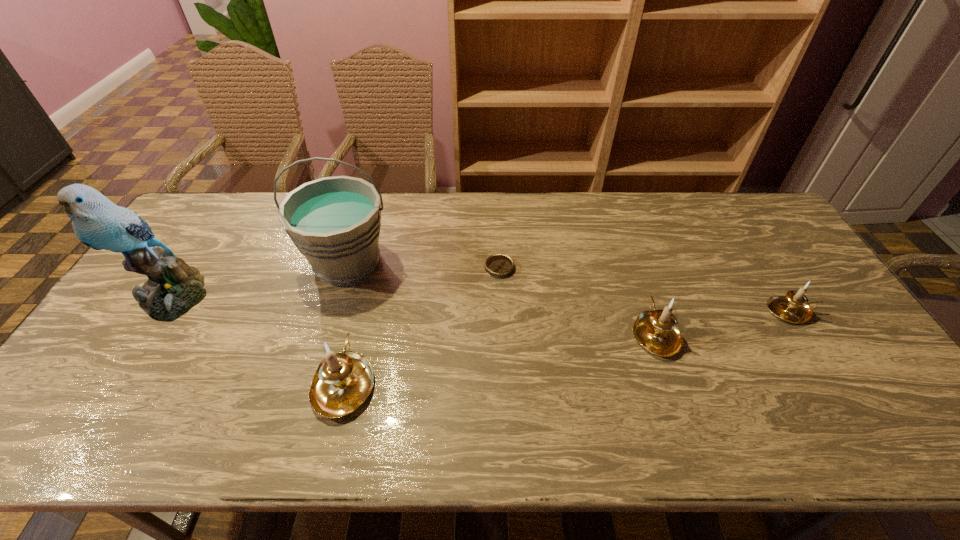
You are a GUI agent. You are given a task and a screenshot of the screen. Output one action in this format:
    pyautogui.click(x=<x>, y=<y>)
    Task: Click on the object that is at the near edge
    The width and height of the screenshot is (960, 540).
    Given the screenshot: What is the action you would take?
    pyautogui.click(x=343, y=381)

The width and height of the screenshot is (960, 540). Identify the location of object at the left edge. (173, 288).

The image size is (960, 540). I want to click on object located in the right edge section of the desktop, so click(x=794, y=307).

I want to click on free region at the far edge, so click(x=443, y=230).

The image size is (960, 540). Find the location of `free location at the near edge`. free location at the near edge is located at coordinates (199, 394).

You are a GUI agent. You are given a task and a screenshot of the screen. Output one action in this format:
    pyautogui.click(x=<x>, y=<y>)
    Task: Click on the free space at the left edge of the desktop
    The width and height of the screenshot is (960, 540).
    Given the screenshot: What is the action you would take?
    pyautogui.click(x=119, y=312)

This screenshot has height=540, width=960. In the image, there is a desktop. What are the coordinates of `vacant region at the right edge` in the screenshot? It's located at tap(781, 255).

Where is `vacant point at the far left corner`? The height and width of the screenshot is (540, 960). vacant point at the far left corner is located at coordinates pos(195,226).

This screenshot has width=960, height=540. I want to click on vacant space at the far right corner of the desktop, so click(x=758, y=201).

Where is `free space at the near right corner of the desktop`? free space at the near right corner of the desktop is located at coordinates (838, 387).